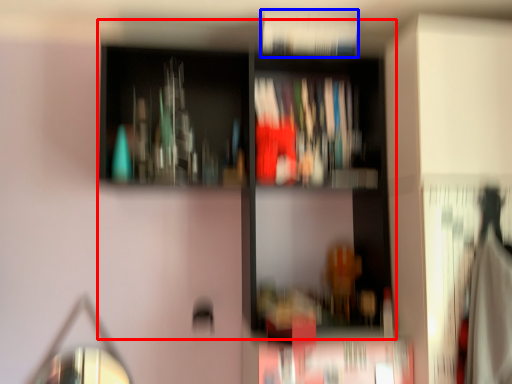
Question: Which of the following is the farthest to the observer, bookcase (highlighted by a red box) or book (highlighted by a blue box)?

Choices:
 (A) bookcase
 (B) book

Answer: (B)